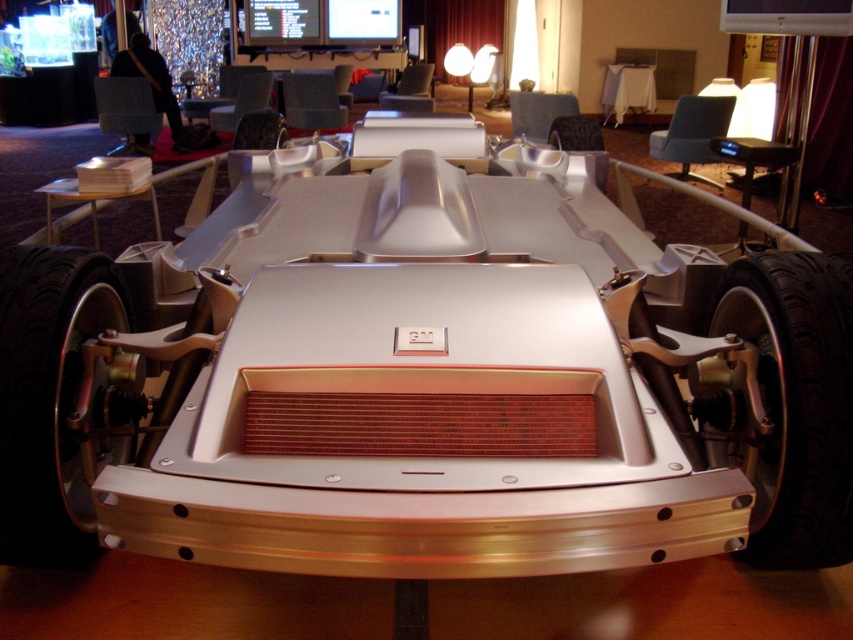
Question: Which object appears farthest from the camera in this image?

Choices:
 (A) polished silver wheel at lower left
 (B) black rubber tire at lower right

Answer: (B)

Question: Does black rubber tire at lower right appear on the left side of polished silver wheel at lower left?

Choices:
 (A) yes
 (B) no

Answer: (B)

Question: Which of the following is the closest to the observer?

Choices:
 (A) (80, 308)
 (B) (724, 289)

Answer: (A)

Question: Which point is closer to the camera?

Choices:
 (A) metallic silver car at center
 (B) polished silver wheel at lower left
 (C) black rubber tire at lower right

Answer: (A)

Question: Is black rubber tire at lower right to the right of polished silver wheel at lower left from the viewer's perspective?

Choices:
 (A) yes
 (B) no

Answer: (A)

Question: From the image, what is the correct spatial relationship of black rubber tire at lower right in relation to polished silver wheel at lower left?

Choices:
 (A) above
 (B) below

Answer: (A)